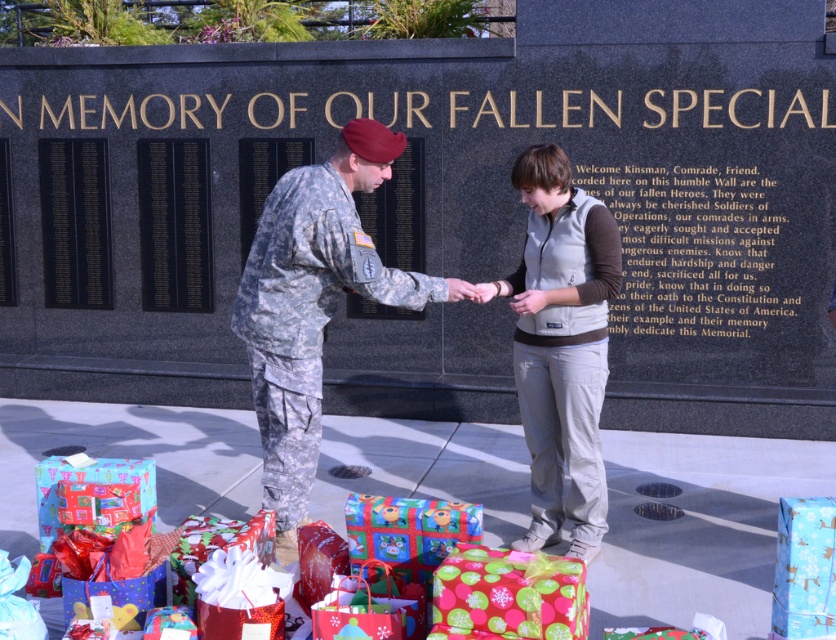
Between green polka dot paper at lower center and shiny wrapping paper gift at center, which one appears on the left side from the viewer's perspective?

From the viewer's perspective, shiny wrapping paper gift at center appears more on the left side.

Is point (518, 579) positioned behind point (456, 516)?

No, (518, 579) is in front of (456, 516).

Where is `green polka dot paper at lower center`? The height and width of the screenshot is (640, 836). green polka dot paper at lower center is located at coordinates (508, 595).

Describe the element at coordinates (508, 595) in the screenshot. I see `green polka dot paper at lower center` at that location.

Which is in front, point (531, 566) or point (48, 532)?

Point (531, 566) is in front.

Where is `green polka dot paper at lower center`? The height and width of the screenshot is (640, 836). green polka dot paper at lower center is located at coordinates (508, 595).

Is point (279, 513) less distant than point (777, 540)?

No, it is not.

Who is taller, camouflage fabric uniform at center or blue shiny wrapping paper at lower right?

With more height is camouflage fabric uniform at center.

Does point (294, 305) come closer to viewer compared to point (826, 554)?

That is False.

The image size is (836, 640). Find the location of `camouflage fabric uniform at center`. camouflage fabric uniform at center is located at coordinates (304, 317).